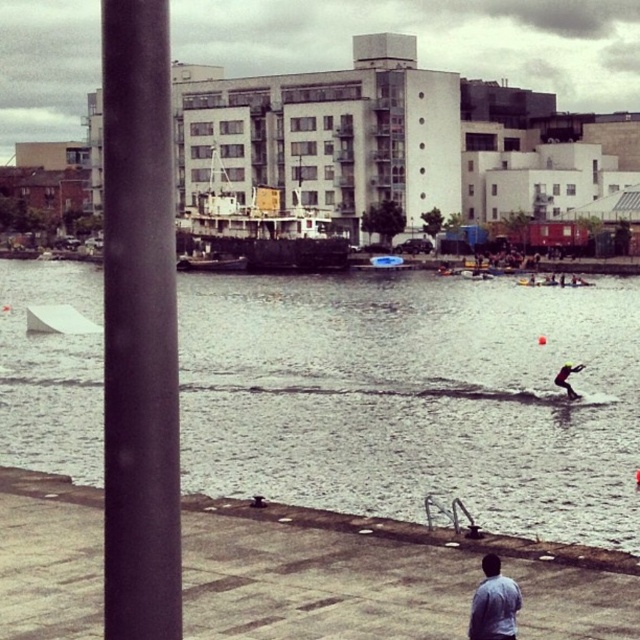
Question: Does wooden ship at center have a greater width compared to light blue shirt at lower center?

Choices:
 (A) yes
 (B) no

Answer: (A)

Question: Does wooden ship at center have a greater width compared to blue plastic boat at center?

Choices:
 (A) yes
 (B) no

Answer: (A)

Question: Which object appears closest to the camera in this image?

Choices:
 (A) wooden ship at center
 (B) light blue shirt at lower center
 (C) gray concrete water at center
 (D) smooth white surfboard at right

Answer: (B)

Question: Can you confirm if gray concrete water at center is smaller than metallic gray boat at center?

Choices:
 (A) yes
 (B) no

Answer: (B)

Question: Which is nearer to the gray concrete water at center?

Choices:
 (A) wooden ship at center
 (B) light blue shirt at lower center

Answer: (A)

Question: Which point is farther to the camera?

Choices:
 (A) (435, 476)
 (B) (204, 262)
 (C) (564, 364)

Answer: (B)